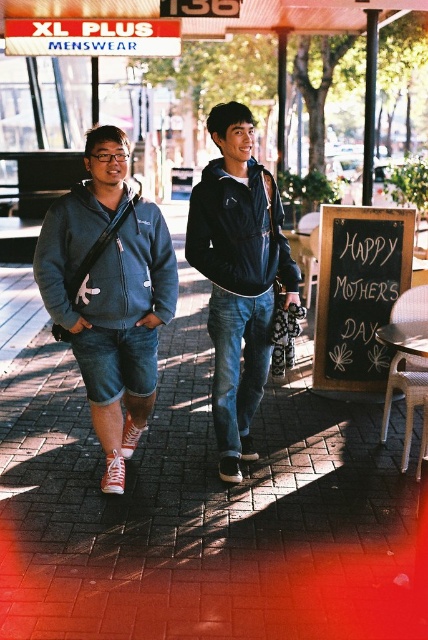
Question: Does dark blue hoodie at center appear over dark blue fleece sweatshirt at center?

Choices:
 (A) yes
 (B) no

Answer: (B)

Question: Does matte blue sweatshirt at left appear over dark blue fleece sweatshirt at center?

Choices:
 (A) yes
 (B) no

Answer: (B)

Question: Which point is closer to the camera taking this photo?

Choices:
 (A) (86, 228)
 (B) (243, 280)

Answer: (A)

Question: Is dark blue hoodie at center thinner than dark blue fleece sweatshirt at center?

Choices:
 (A) no
 (B) yes

Answer: (A)

Question: Which of the following is the farthest from the observer?

Choices:
 (A) dark blue fleece sweatshirt at center
 (B) black chalkboard at lower right
 (C) matte blue hoodie at center

Answer: (B)

Question: Among these points, which one is farthest from the camera?

Choices:
 (A) (255, 214)
 (B) (377, 276)
 (C) (261, 582)
 (D) (100, 317)

Answer: (B)